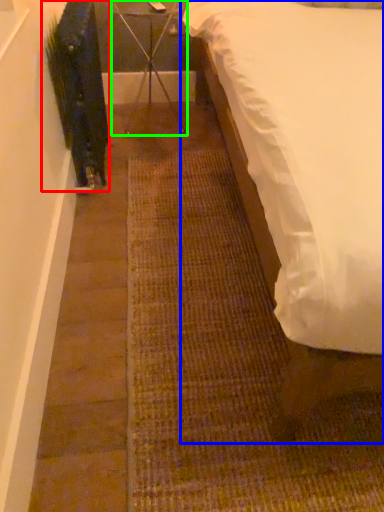
Question: Which object is the farthest from plant (highlighted by a red box)? Choose among these: bed (highlighted by a blue box) or furniture (highlighted by a green box).

Choices:
 (A) bed
 (B) furniture

Answer: (A)